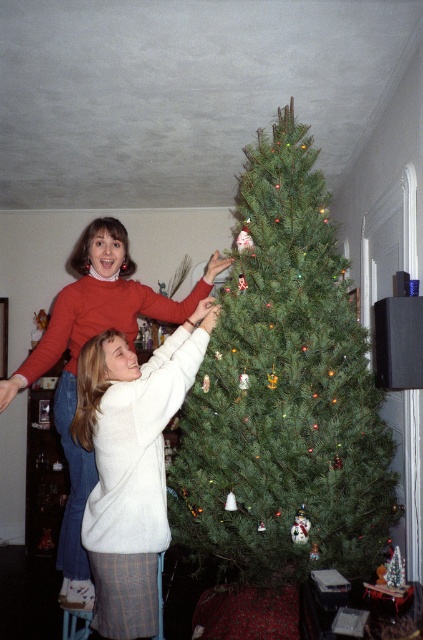
Question: Among these points, which one is nearest to the camera?

Choices:
 (A) (261, 349)
 (B) (203, 294)

Answer: (A)

Question: Which object appears farthest from the camera in this image?

Choices:
 (A) green matte christmas tree at center
 (B) matte red sweater at upper left

Answer: (A)

Question: Among these objects, which one is nearest to the camera?

Choices:
 (A) green matte christmas tree at center
 (B) matte red sweater at upper left

Answer: (B)

Question: Does green matte christmas tree at center appear on the right side of matte red sweater at upper left?

Choices:
 (A) yes
 (B) no

Answer: (A)

Question: In this image, where is green matte christmas tree at center located relative to matte red sweater at upper left?

Choices:
 (A) right
 (B) left

Answer: (A)

Question: Where is green matte christmas tree at center located in relation to matte red sweater at upper left in the image?

Choices:
 (A) right
 (B) left

Answer: (A)